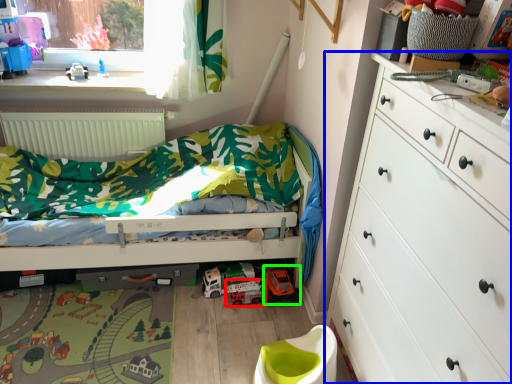
Question: Which object is positioned closest to toy car (highlighted by a red box)? Select from chest of drawers (highlighted by a blue box) and toy (highlighted by a green box).

Choices:
 (A) chest of drawers
 (B) toy

Answer: (B)